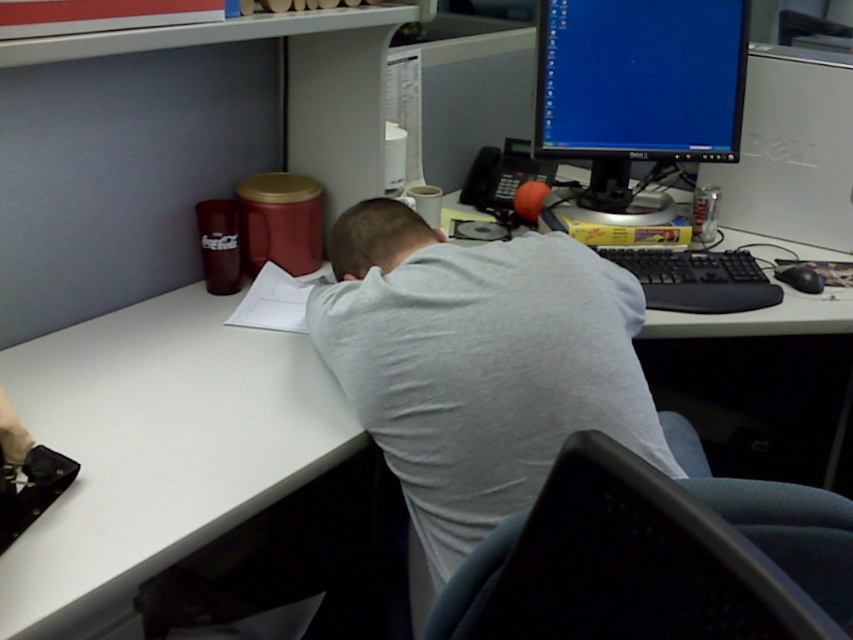
Question: Among these objects, which one is nearest to the camera?

Choices:
 (A) white plastic desk at center
 (B) gray cotton shirt at center

Answer: (A)

Question: Which point is closer to the camera taking this photo?

Choices:
 (A) (554, 412)
 (B) (695, 81)

Answer: (A)

Question: Does gray cotton shirt at center appear on the left side of black glossy monitor at upper right?

Choices:
 (A) no
 (B) yes

Answer: (B)

Question: Estimate the real-world distances between objects in this image. Which object is farther from the gray cotton shirt at center?

Choices:
 (A) white plastic desk at center
 (B) black glossy monitor at upper right

Answer: (B)

Question: Does white plastic desk at center have a lesser width compared to black glossy monitor at upper right?

Choices:
 (A) yes
 (B) no

Answer: (B)

Question: From the image, what is the correct spatial relationship of gray cotton shirt at center in relation to black glossy monitor at upper right?

Choices:
 (A) above
 (B) below

Answer: (B)